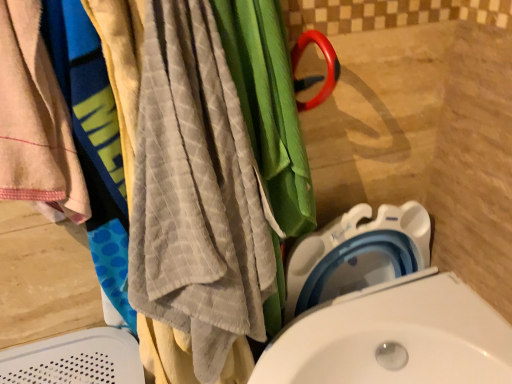
This screenshot has height=384, width=512. What do you see at coordinates (195, 207) in the screenshot? I see `gray textured towel at left` at bounding box center [195, 207].

Identify the location of gray textured towel at left. The height and width of the screenshot is (384, 512). (195, 207).

Looking at this image, from a real-world perspective, is gray textured towel at left positioned above or below beige cotton towel at left?

In terms of real-world spatial position, gray textured towel at left is below beige cotton towel at left.

Is gray textured towel at left thinner than beige cotton towel at left?

Incorrect, the width of gray textured towel at left is not less than that of beige cotton towel at left.

Does gray textured towel at left have a larger size compared to beige cotton towel at left?

Yes.

Locate an element on the screen. Image resolution: width=512 pixels, height=384 pixels. towel above the gray textured towel at left (from the image's perspective) is located at coordinates (35, 119).

From the image's perspective, which object appears higher, beige cotton towel at left or white plastic toilet at lower right?

beige cotton towel at left, from the image's perspective.

Where is `toilet that appears on the right of beige cotton towel at left`? This screenshot has height=384, width=512. toilet that appears on the right of beige cotton towel at left is located at coordinates (382, 310).

Is beige cotton towel at left far from white plastic toilet at lower right?

No, beige cotton towel at left is in close proximity to white plastic toilet at lower right.

Does point (28, 42) come behind point (250, 382)?

No, it is in front of (250, 382).

From the image's perspective, who appears lower, white plastic toilet at lower right or beige cotton towel at left?

white plastic toilet at lower right, from the image's perspective.

Is white plastic toilet at lower right positioned far away from beige cotton towel at left?

Actually, white plastic toilet at lower right and beige cotton towel at left are a little close together.

Looking at this image, do you think white plastic toilet at lower right is within beige cotton towel at left, or outside of it?

white plastic toilet at lower right cannot be found inside beige cotton towel at left.

Is white plastic toilet at lower right oriented towards beige cotton towel at left?

No, white plastic toilet at lower right is not aimed at beige cotton towel at left.

Does gray textured towel at left lie behind white plastic toilet at lower right?

No, the depth of gray textured towel at left is less than that of white plastic toilet at lower right.

Looking at this image, is gray textured towel at left far away from white plastic toilet at lower right?

Actually, gray textured towel at left and white plastic toilet at lower right are a little close together.

Between gray textured towel at left and white plastic toilet at lower right, which one appears on the right side from the viewer's perspective?

white plastic toilet at lower right.

Considering the sizes of objects gray textured towel at left and white plastic toilet at lower right in the image provided, who is bigger, gray textured towel at left or white plastic toilet at lower right?

With larger size is gray textured towel at left.

How many degrees apart are the facing directions of beige cotton towel at left and gray textured towel at left?

The angle between the facing direction of beige cotton towel at left and the facing direction of gray textured towel at left is 0.493 degrees.

Considering the relative sizes of beige cotton towel at left and gray textured towel at left in the image provided, is beige cotton towel at left thinner than gray textured towel at left?

Correct, the width of beige cotton towel at left is less than that of gray textured towel at left.

Is beige cotton towel at left in front of or behind gray textured towel at left in the image?

Visually, beige cotton towel at left is located behind gray textured towel at left.

Which of these two, beige cotton towel at left or gray textured towel at left, is smaller?

beige cotton towel at left.

From a real-world perspective, is white plastic toilet at lower right beneath gray textured towel at left?

Indeed, from a real-world perspective, white plastic toilet at lower right is positioned beneath gray textured towel at left.

Which of these two, white plastic toilet at lower right or gray textured towel at left, is wider?

Wider between the two is gray textured towel at left.

Where is `beach towel in front of the beige cotton towel at left`? beach towel in front of the beige cotton towel at left is located at coordinates (195, 207).

The width and height of the screenshot is (512, 384). In the image, there is a beige cotton towel at left. Find the location of `toilet below it (from the image's perspective)`. toilet below it (from the image's perspective) is located at coordinates (382, 310).

Based on their spatial positions, is gray textured towel at left or white plastic toilet at lower right further from beige cotton towel at left?

white plastic toilet at lower right is further to beige cotton towel at left.

Based on their spatial positions, is white plastic toilet at lower right or gray textured towel at left closer to beige cotton towel at left?

gray textured towel at left.

Which object lies nearer to the anchor point gray textured towel at left, white plastic toilet at lower right or beige cotton towel at left?

beige cotton towel at left is positioned closer to the anchor gray textured towel at left.

Looking at the image, which one is located closer to gray textured towel at left, beige cotton towel at left or white plastic toilet at lower right?

The object closer to gray textured towel at left is beige cotton towel at left.

Based on their spatial positions, is beige cotton towel at left or gray textured towel at left further from white plastic toilet at lower right?

beige cotton towel at left lies further to white plastic toilet at lower right than the other object.

When comparing their distances from white plastic toilet at lower right, does gray textured towel at left or beige cotton towel at left seem closer?

gray textured towel at left.

Locate an element on the screen. Image resolution: width=512 pixels, height=384 pixels. beach towel situated between beige cotton towel at left and white plastic toilet at lower right from left to right is located at coordinates (195, 207).